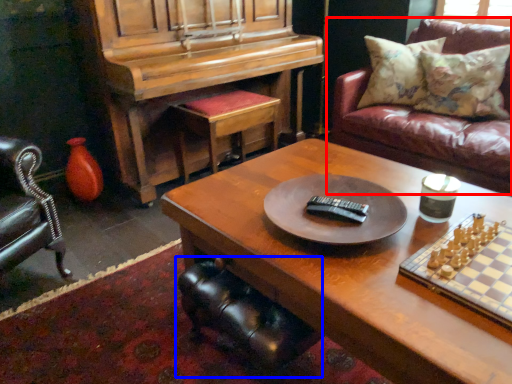
Question: Which object is further to the camera taking this photo, studio couch (highlighted by a red box) or swivel chair (highlighted by a blue box)?

Choices:
 (A) studio couch
 (B) swivel chair

Answer: (A)